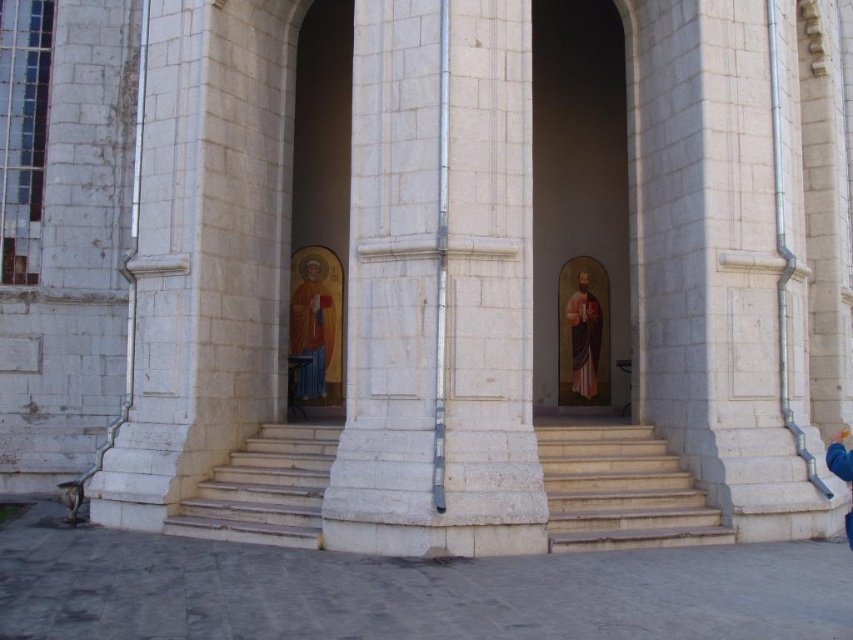
Question: Can you confirm if matte gold icon at left is smaller than golden textured icon at center?

Choices:
 (A) no
 (B) yes

Answer: (A)

Question: Which object is farther from the camera taking this photo?

Choices:
 (A) golden textured icon at center
 (B) matte wooden icon at center
 (C) matte gold icon at left

Answer: (A)

Question: Is matte gold icon at left in front of white stone stairs at center?

Choices:
 (A) yes
 (B) no

Answer: (B)

Question: Which point is closer to the camera?

Choices:
 (A) (608, 237)
 (B) (589, 323)

Answer: (B)

Question: Estimate the real-world distances between objects in this image. Which object is farther from the golden painted icon at center?

Choices:
 (A) matte gold icon at left
 (B) golden textured icon at center

Answer: (B)

Question: Does matte wooden icon at center come in front of matte gold icon at left?

Choices:
 (A) yes
 (B) no

Answer: (A)